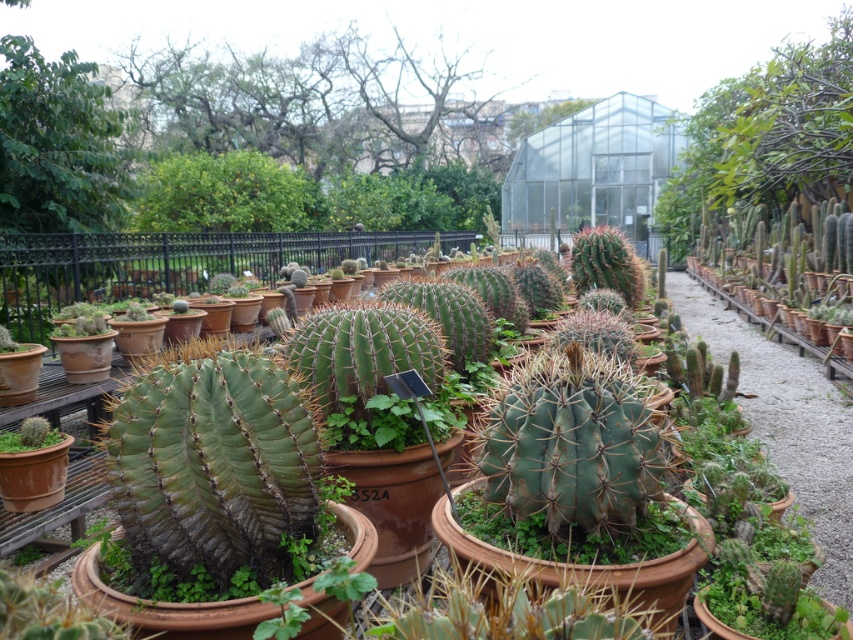
Question: Which point appears farthest from the camera in this image?

Choices:
 (A) (71, 410)
 (B) (9, 448)

Answer: (A)

Question: Can you confirm if green matte cactus at center is smaller than green matte cactus at lower left?

Choices:
 (A) yes
 (B) no

Answer: (B)

Question: Is green matte cactus at center below green matte cactus at lower left?

Choices:
 (A) yes
 (B) no

Answer: (B)

Question: Among these objects, which one is farthest from the camera?

Choices:
 (A) green matte cactus at lower left
 (B) green matte cactus at center

Answer: (A)

Question: Is green matte cactus at center positioned before green matte cactus at lower left?

Choices:
 (A) no
 (B) yes

Answer: (B)